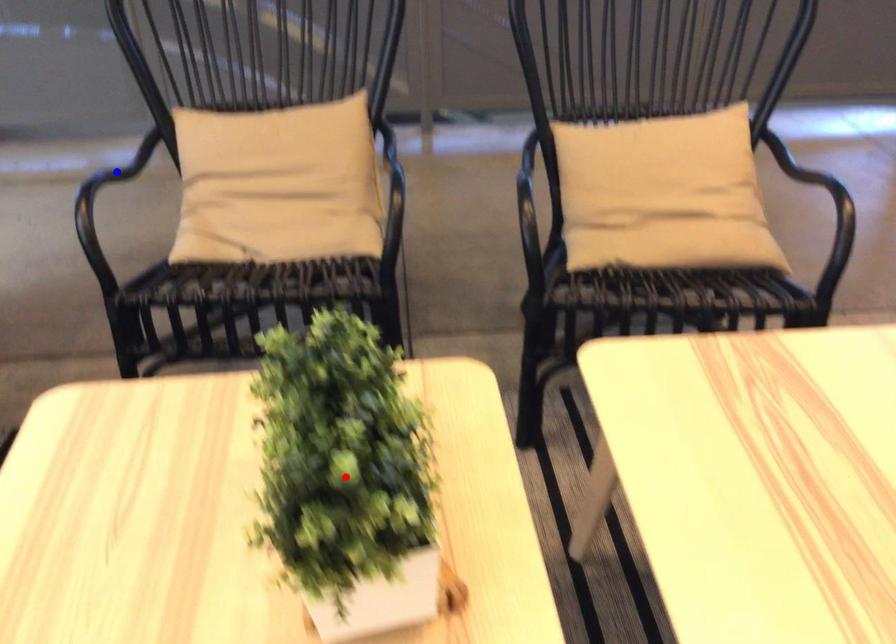
Question: Two points are marked on the image. Which point is closer to the camera?

Choices:
 (A) Blue point is closer.
 (B) Red point is closer.

Answer: (B)